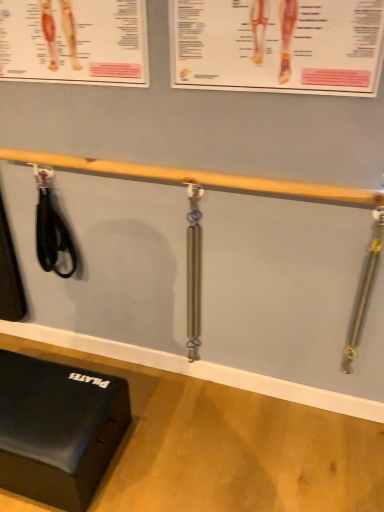
What is the approximate width of silver metallic resistance band at right, the third tool positioned from the left?

The width of silver metallic resistance band at right, the third tool positioned from the left, is 2.52 inches.

Identify the location of silver metallic resistance band at center, the 2th tool positioned from the right. click(194, 271).

You are a GUI agent. You are given a task and a screenshot of the screen. Output one action in this format:
    pyautogui.click(x=<x>, y=<y>)
    Task: Click on the black rubber strap at left, marked as the 1th tool in a left-to-right arrangement
    This screenshot has height=512, width=384.
    Given the screenshot: What is the action you would take?
    pyautogui.click(x=51, y=227)

What do you see at coordinates (58, 429) in the screenshot? This screenshot has height=512, width=384. I see `black rubber exercise mat at lower left` at bounding box center [58, 429].

Find the location of a particular element. wooden beam at upper center is located at coordinates (200, 178).

Is silver metallic resistance band at right, the third tool positioned from the left, positioned behind wooden beam at upper center?

Yes, silver metallic resistance band at right, the third tool positioned from the left, is behind wooden beam at upper center.

Considering the relative sizes of silver metallic resistance band at right, the third tool positioned from the left, and wooden beam at upper center in the image provided, is silver metallic resistance band at right, the third tool positioned from the left, taller than wooden beam at upper center?

Indeed, silver metallic resistance band at right, the third tool positioned from the left, has a greater height compared to wooden beam at upper center.

Between silver metallic resistance band at right, the first tool positioned from the right, and wooden beam at upper center, which one has smaller width?

Thinner between the two is silver metallic resistance band at right, the first tool positioned from the right.

Based on the photo, between wooden beam at upper center and silver metallic resistance band at center, the 2th tool positioned from the right, which one is positioned behind?

silver metallic resistance band at center, the 2th tool positioned from the right, is behind.

Consider the image. Between wooden beam at upper center and silver metallic resistance band at center, which is the 2th tool in left-to-right order, which one has smaller width?

wooden beam at upper center.

From the image's perspective, which is above, wooden beam at upper center or silver metallic resistance band at center, which is the 2th tool in left-to-right order?

wooden beam at upper center appears higher in the image.

How distant is wooden beam at upper center from silver metallic resistance band at center, the 2th tool positioned from the right?

wooden beam at upper center is 35.46 centimeters away from silver metallic resistance band at center, the 2th tool positioned from the right.

From the image's perspective, relative to black rubber exercise mat at lower left, is silver metallic resistance band at right, the third tool positioned from the left, above or below?

silver metallic resistance band at right, the third tool positioned from the left, is situated higher than black rubber exercise mat at lower left in the image.

Is silver metallic resistance band at right, the first tool positioned from the right, outside of black rubber exercise mat at lower left?

Yes, silver metallic resistance band at right, the first tool positioned from the right, is located beyond the bounds of black rubber exercise mat at lower left.

Can you confirm if silver metallic resistance band at right, the third tool positioned from the left, is positioned to the left of black rubber exercise mat at lower left?

Incorrect, silver metallic resistance band at right, the third tool positioned from the left, is not on the left side of black rubber exercise mat at lower left.

Is silver metallic resistance band at right, the first tool positioned from the right, taller or shorter than black rubber exercise mat at lower left?

In the image, silver metallic resistance band at right, the first tool positioned from the right, appears to be taller than black rubber exercise mat at lower left.

Is black rubber exercise mat at lower left directly adjacent to wooden beam at upper center?

They are not placed beside each other.

Based on the photo, looking at the image, does black rubber exercise mat at lower left seem bigger or smaller compared to wooden beam at upper center?

Considering their sizes, black rubber exercise mat at lower left takes up more space than wooden beam at upper center.

Is black rubber exercise mat at lower left spatially inside wooden beam at upper center, or outside of it?

black rubber exercise mat at lower left is outside wooden beam at upper center.

Where is `furniture that is under the wooden beam at upper center (from a real-world perspective)`? The height and width of the screenshot is (512, 384). furniture that is under the wooden beam at upper center (from a real-world perspective) is located at coordinates (58, 429).

From the image's perspective, which object appears higher, black rubber exercise mat at lower left or silver metallic resistance band at center, which is the 2th tool in left-to-right order?

silver metallic resistance band at center, which is the 2th tool in left-to-right order.

Is point (21, 492) positioned before point (193, 248)?

Yes.

Locate an element on the screen. Image resolution: width=384 pixels, height=512 pixels. furniture beneath the silver metallic resistance band at center, the 2th tool positioned from the right (from a real-world perspective) is located at coordinates (58, 429).

From a real-world perspective, is black rubber exercise mat at lower left above or below silver metallic resistance band at center, the 2th tool positioned from the right?

black rubber exercise mat at lower left is below silver metallic resistance band at center, the 2th tool positioned from the right.

Is silver metallic resistance band at center, which is the 2th tool in left-to-right order, situated inside wooden beam at upper center or outside?

silver metallic resistance band at center, which is the 2th tool in left-to-right order, lies outside wooden beam at upper center.

Is silver metallic resistance band at center, the 2th tool positioned from the right, oriented towards wooden beam at upper center?

No, silver metallic resistance band at center, the 2th tool positioned from the right, is not aimed at wooden beam at upper center.

Can you confirm if silver metallic resistance band at center, which is the 2th tool in left-to-right order, is bigger than wooden beam at upper center?

No.

Which object is thinner, silver metallic resistance band at center, which is the 2th tool in left-to-right order, or wooden beam at upper center?

wooden beam at upper center.

Is wooden beam at upper center turned away from black rubber strap at left, which is the 3th tool from right to left?

wooden beam at upper center does not have its back to black rubber strap at left, which is the 3th tool from right to left.

Can you confirm if wooden beam at upper center is bigger than black rubber strap at left, which is the 3th tool from right to left?

Correct, wooden beam at upper center is larger in size than black rubber strap at left, which is the 3th tool from right to left.

Would you say wooden beam at upper center is to the left or to the right of black rubber strap at left, marked as the 1th tool in a left-to-right arrangement, in the picture?

Based on their positions, wooden beam at upper center is located to the right of black rubber strap at left, marked as the 1th tool in a left-to-right arrangement.

From a real-world perspective, which is physically below, wooden beam at upper center or black rubber strap at left, marked as the 1th tool in a left-to-right arrangement?

From a 3D spatial view, black rubber strap at left, marked as the 1th tool in a left-to-right arrangement, is below.

Find the location of `beam above the silver metallic resistance band at right, the third tool positioned from the left (from a real-world perspective)`. beam above the silver metallic resistance band at right, the third tool positioned from the left (from a real-world perspective) is located at coordinates (200, 178).

What are the coordinates of `beam above the silver metallic resistance band at center, which is the 2th tool in left-to-right order (from the image's perspective)` in the screenshot? It's located at (200, 178).

From the image, which object appears to be nearer to silver metallic resistance band at right, the first tool positioned from the right, black rubber strap at left, which is the 3th tool from right to left, or wooden beam at upper center?

Among the two, wooden beam at upper center is located nearer to silver metallic resistance band at right, the first tool positioned from the right.

When comparing their distances from silver metallic resistance band at center, the 2th tool positioned from the right, does black rubber strap at left, marked as the 1th tool in a left-to-right arrangement, or wooden beam at upper center seem further?

The object further to silver metallic resistance band at center, the 2th tool positioned from the right, is black rubber strap at left, marked as the 1th tool in a left-to-right arrangement.

Which object lies further to the anchor point black rubber strap at left, marked as the 1th tool in a left-to-right arrangement, wooden beam at upper center or black rubber exercise mat at lower left?

black rubber exercise mat at lower left is positioned further to the anchor black rubber strap at left, marked as the 1th tool in a left-to-right arrangement.

Considering their positions, is black rubber strap at left, marked as the 1th tool in a left-to-right arrangement, positioned further to black rubber exercise mat at lower left than silver metallic resistance band at center, the 2th tool positioned from the right?

Based on the image, black rubber strap at left, marked as the 1th tool in a left-to-right arrangement, appears to be further to black rubber exercise mat at lower left.

Looking at the image, which one is located further to silver metallic resistance band at center, the 2th tool positioned from the right, black rubber strap at left, which is the 3th tool from right to left, or silver metallic resistance band at right, the first tool positioned from the right?

silver metallic resistance band at right, the first tool positioned from the right, is positioned further to the anchor silver metallic resistance band at center, the 2th tool positioned from the right.

Which object lies further to the anchor point silver metallic resistance band at right, the third tool positioned from the left, black rubber strap at left, which is the 3th tool from right to left, or black rubber exercise mat at lower left?

The object further to silver metallic resistance band at right, the third tool positioned from the left, is black rubber strap at left, which is the 3th tool from right to left.

Based on their spatial positions, is wooden beam at upper center or silver metallic resistance band at center, which is the 2th tool in left-to-right order, closer to black rubber strap at left, marked as the 1th tool in a left-to-right arrangement?

wooden beam at upper center is positioned closer to the anchor black rubber strap at left, marked as the 1th tool in a left-to-right arrangement.

Considering their positions, is silver metallic resistance band at center, the 2th tool positioned from the right, positioned further to black rubber exercise mat at lower left than black rubber strap at left, which is the 3th tool from right to left?

black rubber strap at left, which is the 3th tool from right to left.

Find the location of a particular element. The width and height of the screenshot is (384, 512). beam between black rubber strap at left, which is the 3th tool from right to left, and silver metallic resistance band at center, which is the 2th tool in left-to-right order, from left to right is located at coordinates (x=200, y=178).

Locate an element on the screen. tool situated between wooden beam at upper center and silver metallic resistance band at right, the third tool positioned from the left, from left to right is located at coordinates (194, 271).

Image resolution: width=384 pixels, height=512 pixels. What are the coordinates of `beam between black rubber exercise mat at lower left and silver metallic resistance band at right, the first tool positioned from the right, from left to right` in the screenshot? It's located at (200, 178).

I want to click on tool situated between black rubber strap at left, marked as the 1th tool in a left-to-right arrangement, and silver metallic resistance band at right, the first tool positioned from the right, from left to right, so click(x=194, y=271).